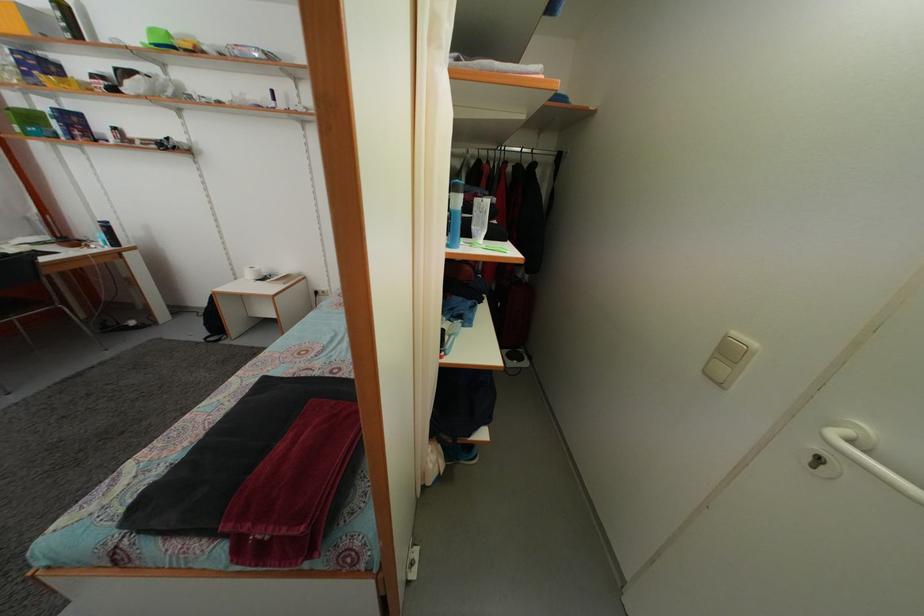
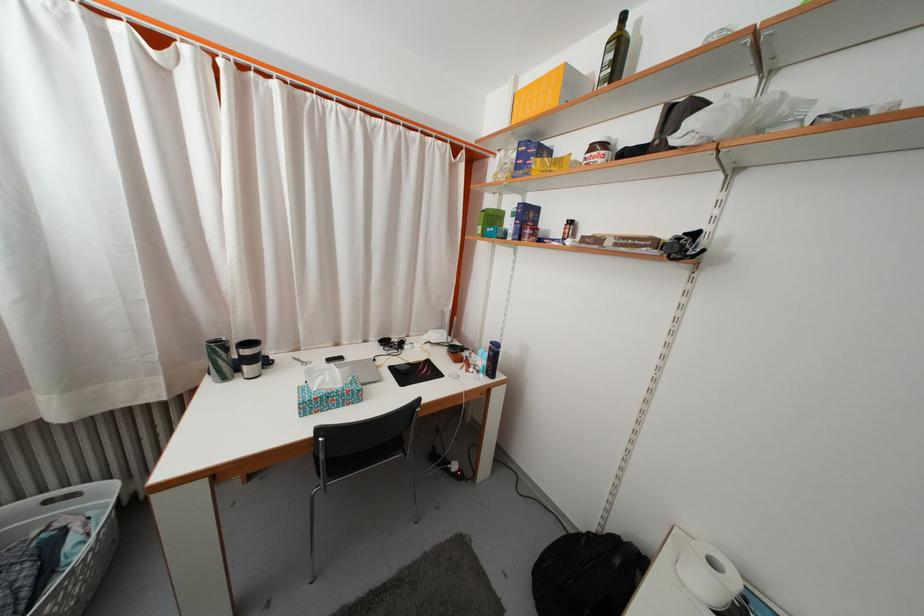
Locate, in the second image, the point that corresponds to point (30, 79) in the first image.

(523, 175)